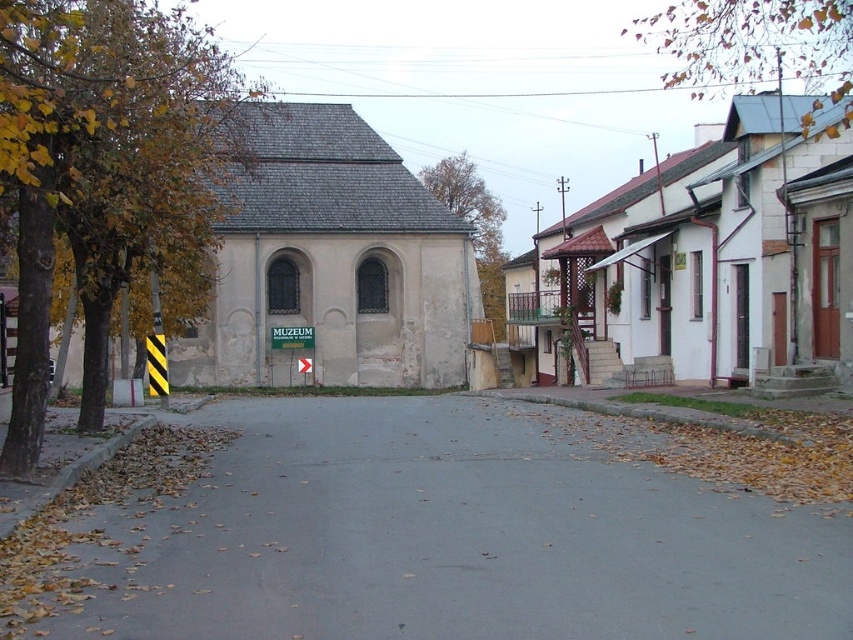
You are a delivery driver who needs to park your truck on the gray asphalt road at center. The truck requires a space wider than the gray stone church at center. Can you park there?

The gray asphalt road at center is thinner than gray stone church at center, so the road is not wide enough to accommodate the truck which needs a space wider than the church. Choose another location.

You are standing at the point labeled as point [421,532] on the image. What is the type of surface you are currently standing on?

The point [421,532] marks gray asphalt road at center, so you are standing on a gray asphalt road.